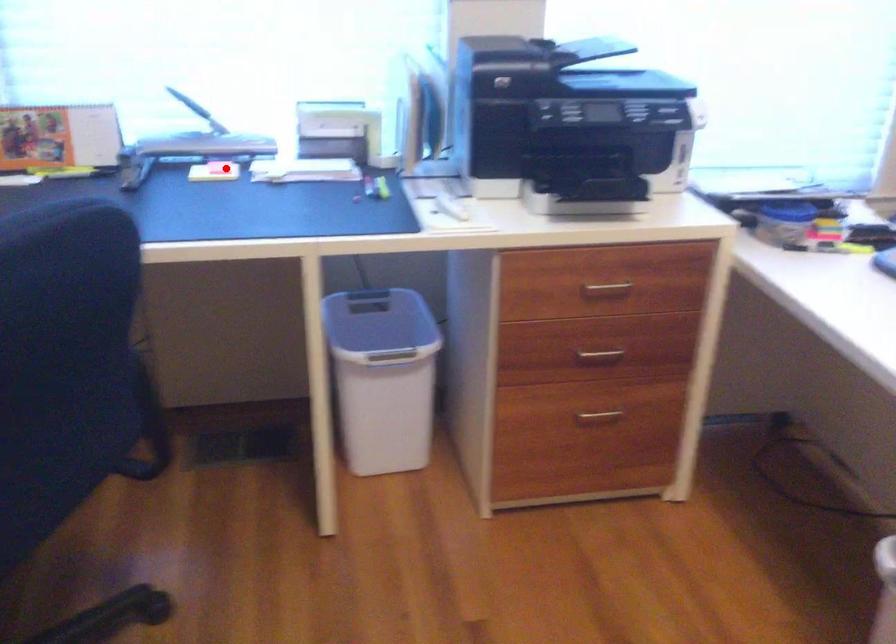
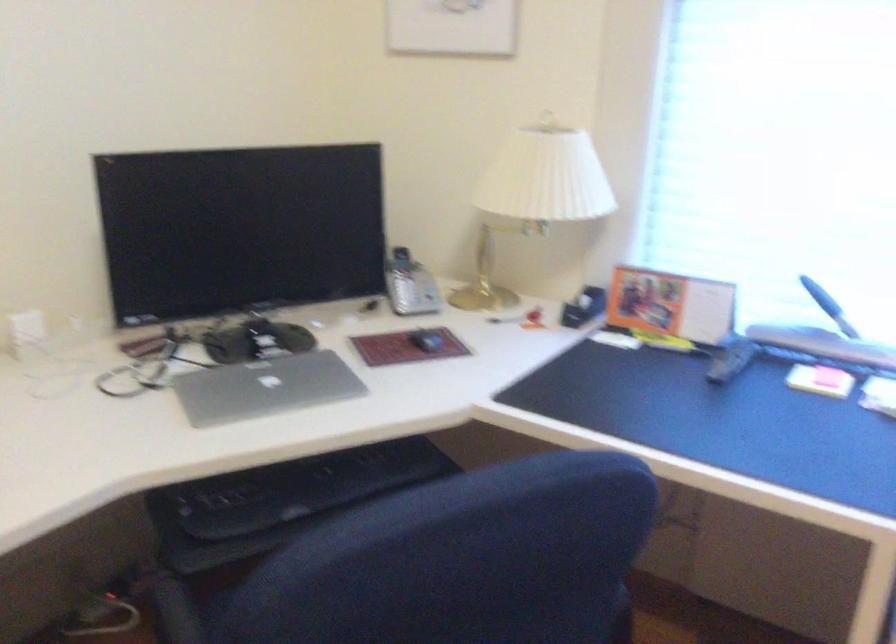
Question: I am providing you with two images of the same scene from different viewpoints. A red point is shown in image1. For the corresponding object point in image2, is it positioned nearer or farther from the camera?

Choices:
 (A) Nearer
 (B) Farther

Answer: (A)